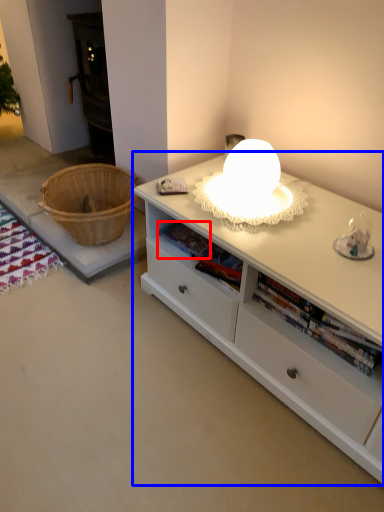
Question: Which of the following is the closest to the observer, book (highlighted by a red box) or desk (highlighted by a blue box)?

Choices:
 (A) book
 (B) desk

Answer: (B)